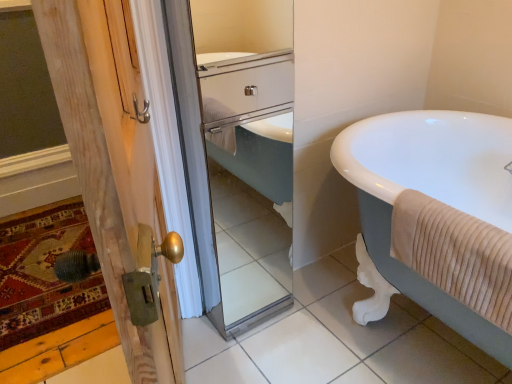
Question: Is clear glass mirror at center oriented away from beige ribbed towel at right?

Choices:
 (A) yes
 (B) no

Answer: (B)

Question: Considering the relative sizes of clear glass mirror at center and beige ribbed towel at right in the image provided, is clear glass mirror at center shorter than beige ribbed towel at right?

Choices:
 (A) no
 (B) yes

Answer: (A)

Question: Is clear glass mirror at center further to camera compared to beige ribbed towel at right?

Choices:
 (A) yes
 (B) no

Answer: (A)

Question: From the image's perspective, would you say clear glass mirror at center is shown under beige ribbed towel at right?

Choices:
 (A) no
 (B) yes

Answer: (A)

Question: Considering the relative sizes of clear glass mirror at center and beige ribbed towel at right in the image provided, is clear glass mirror at center taller than beige ribbed towel at right?

Choices:
 (A) yes
 (B) no

Answer: (A)

Question: Is clear glass mirror at center closer to camera compared to beige ribbed towel at right?

Choices:
 (A) yes
 (B) no

Answer: (B)

Question: From the image's perspective, is white glossy bathtub at right located above clear glass mirror at center?

Choices:
 (A) no
 (B) yes

Answer: (A)

Question: Does white glossy bathtub at right lie behind clear glass mirror at center?

Choices:
 (A) no
 (B) yes

Answer: (A)

Question: Is white glossy bathtub at right facing away from clear glass mirror at center?

Choices:
 (A) no
 (B) yes

Answer: (A)

Question: From a real-world perspective, is white glossy bathtub at right over clear glass mirror at center?

Choices:
 (A) yes
 (B) no

Answer: (B)

Question: From the image's perspective, is white glossy bathtub at right beneath clear glass mirror at center?

Choices:
 (A) no
 (B) yes

Answer: (B)

Question: Is white glossy bathtub at right directly adjacent to clear glass mirror at center?

Choices:
 (A) no
 (B) yes

Answer: (A)

Question: Is wooden door at left bigger than beige ribbed towel at right?

Choices:
 (A) no
 (B) yes

Answer: (B)